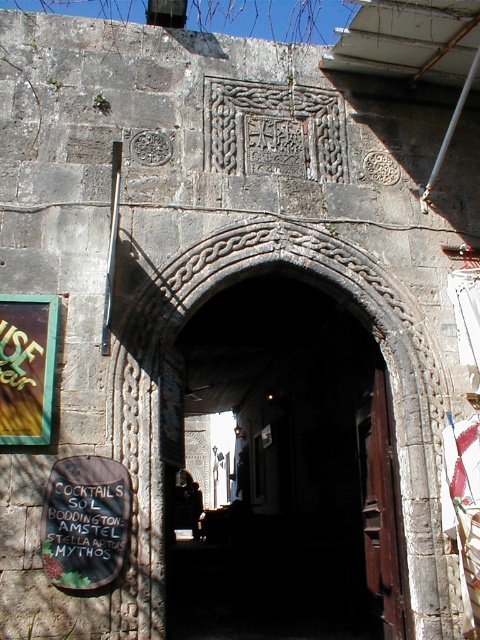
Question: Is the position of black paper sign at center less distant than that of green glass sign at left?

Choices:
 (A) no
 (B) yes

Answer: (B)

Question: Which is nearer to the dark stone archway at center?

Choices:
 (A) green glass sign at left
 (B) black paper sign at center

Answer: (B)

Question: Among these objects, which one is farthest from the camera?

Choices:
 (A) black paper sign at center
 (B) green glass sign at left
 (C) dark stone archway at center

Answer: (C)

Question: Does black paper sign at center appear on the left side of green glass sign at left?

Choices:
 (A) yes
 (B) no

Answer: (B)

Question: Which point is farther to the camera?

Choices:
 (A) (34, 296)
 (B) (284, 531)
 (C) (103, 556)

Answer: (B)

Question: Is dark stone archway at center thinner than black paper sign at center?

Choices:
 (A) yes
 (B) no

Answer: (A)